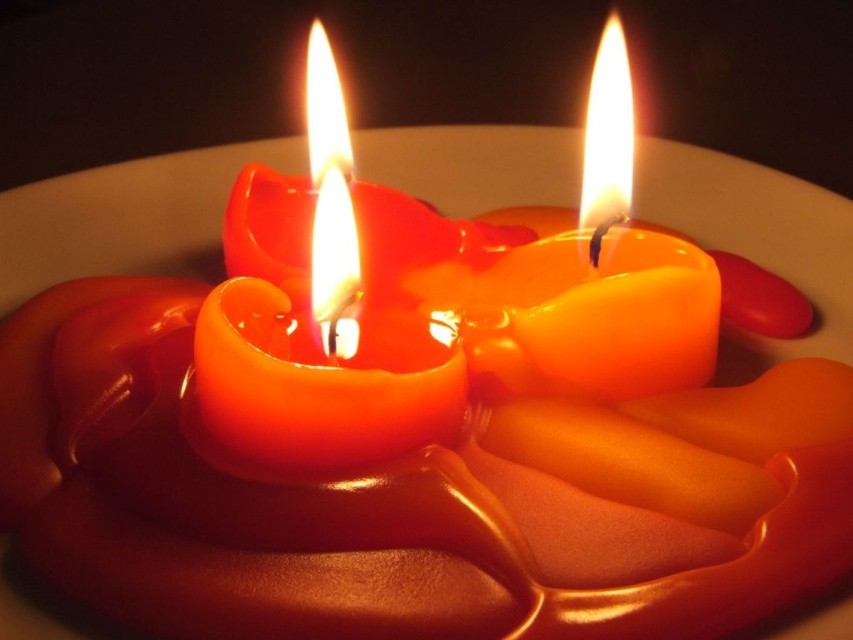
Question: Is glossy wax candle at center below orange glossy candle at center?

Choices:
 (A) no
 (B) yes

Answer: (B)

Question: Which point is farther to the camera?

Choices:
 (A) orange glossy candle at center
 (B) glossy wax candle at center

Answer: (A)

Question: Is glossy wax candle at center to the left of orange glossy candle at center from the viewer's perspective?

Choices:
 (A) yes
 (B) no

Answer: (A)

Question: Does glossy wax candle at center have a greater width compared to orange glossy candle at center?

Choices:
 (A) yes
 (B) no

Answer: (A)

Question: Among these objects, which one is nearest to the camera?

Choices:
 (A) orange glossy candle at center
 (B) glossy wax candle at center

Answer: (B)

Question: Among these points, which one is farthest from the camera?

Choices:
 (A) (322, 401)
 (B) (492, 289)

Answer: (B)